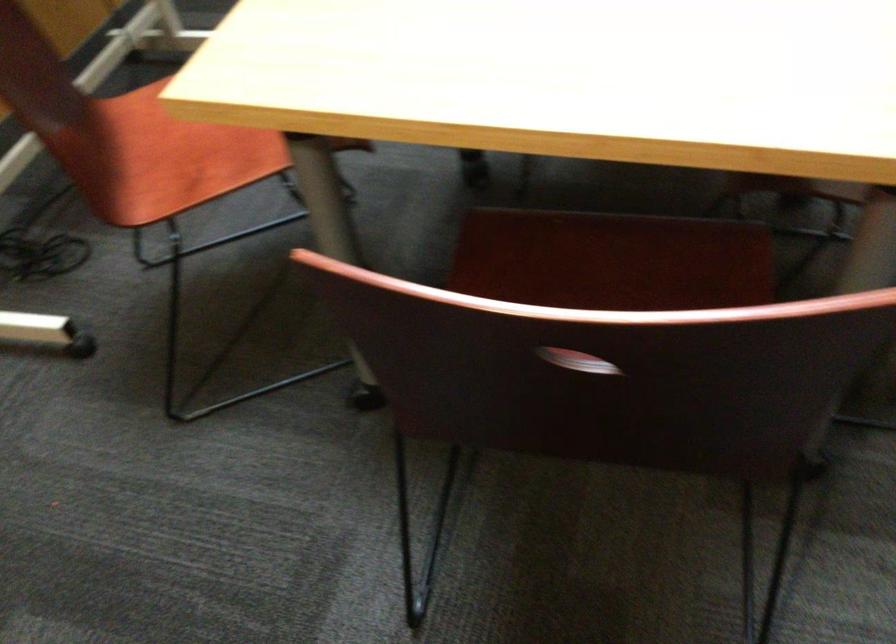
Image resolution: width=896 pixels, height=644 pixels. I want to click on chair back handle, so [576, 361].